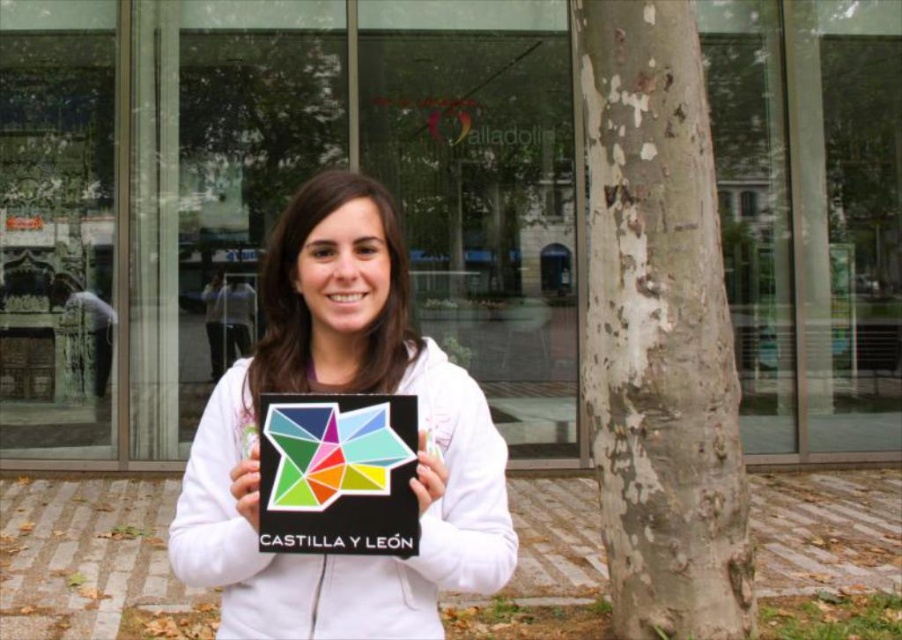
Question: Considering the real-world distances, which object is farthest from the white matte hoodie at center?

Choices:
 (A) multicolored paper star at center
 (B) white textured bark at center

Answer: (B)

Question: From the image, what is the correct spatial relationship of white matte hoodie at center in relation to multicolored paper star at center?

Choices:
 (A) below
 (B) above

Answer: (B)

Question: Estimate the real-world distances between objects in this image. Which object is closer to the white textured bark at center?

Choices:
 (A) white matte hoodie at center
 (B) multicolored paper star at center

Answer: (A)

Question: In this image, where is white textured bark at center located relative to white matte hoodie at center?

Choices:
 (A) left
 (B) right

Answer: (B)

Question: Among these points, which one is farthest from the camera?

Choices:
 (A) click(x=179, y=548)
 (B) click(x=290, y=476)
 (C) click(x=715, y=630)

Answer: (C)

Question: Is white matte hoodie at center positioned at the back of multicolored paper star at center?

Choices:
 (A) yes
 (B) no

Answer: (A)